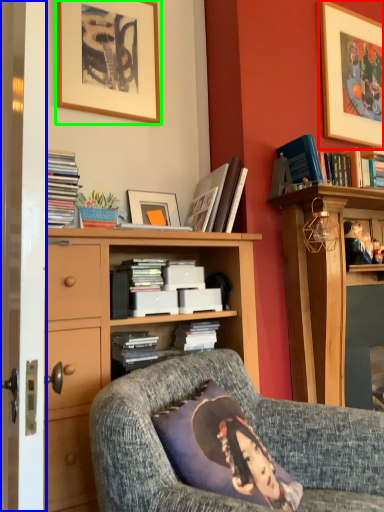
Question: Estimate the real-world distances between objects in this image. Which object is farther from picture frame (highlighted by a red box), screen door (highlighted by a blue box) or picture frame (highlighted by a green box)?

Choices:
 (A) screen door
 (B) picture frame

Answer: (A)